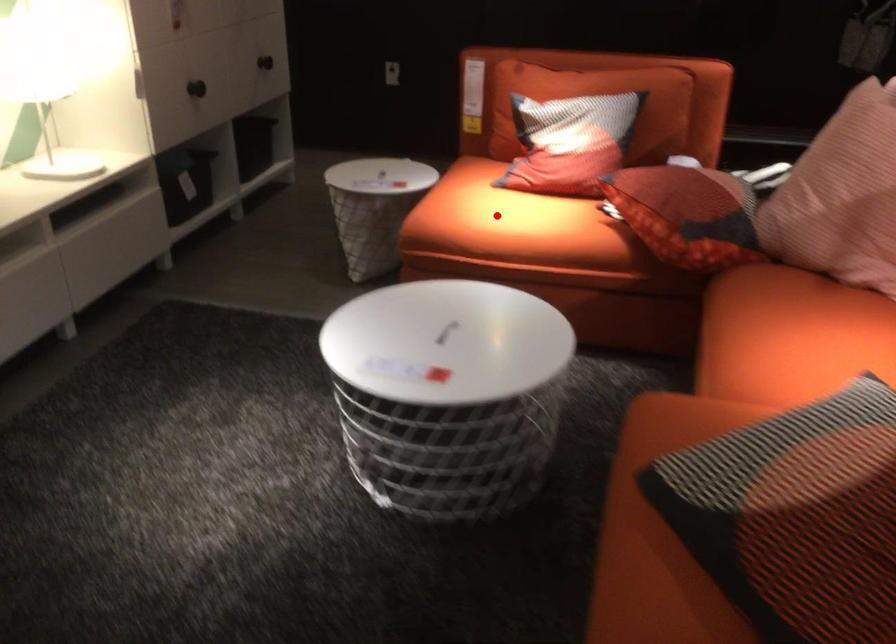
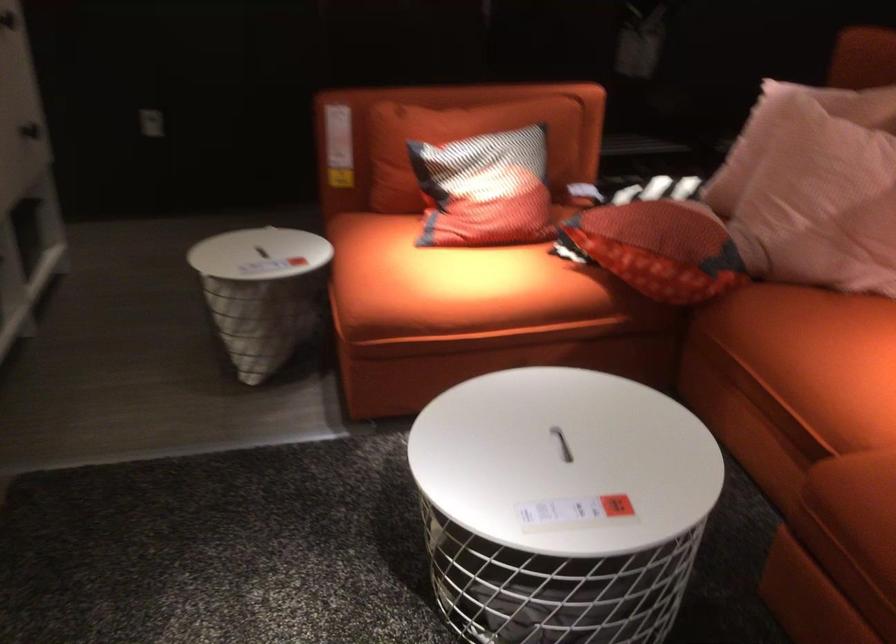
Question: I am providing you with two images of the same scene from different viewpoints. A red point is shown in image1. For the corresponding object point in image2, is it positioned nearer or farther from the camera?

Choices:
 (A) Nearer
 (B) Farther

Answer: (A)